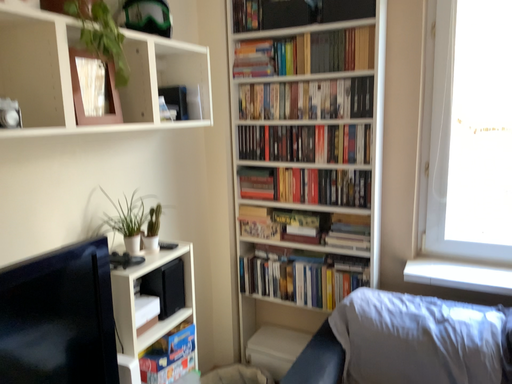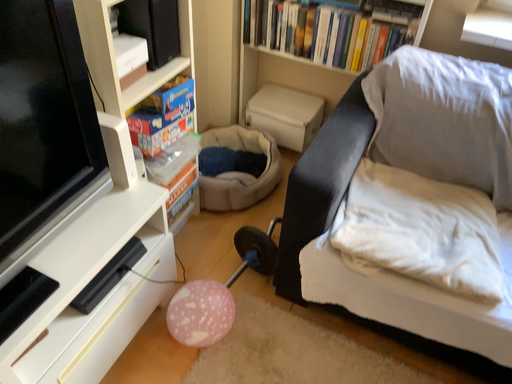
Question: How did the camera likely rotate when shooting the video?

Choices:
 (A) rotated downward
 (B) rotated upward

Answer: (A)